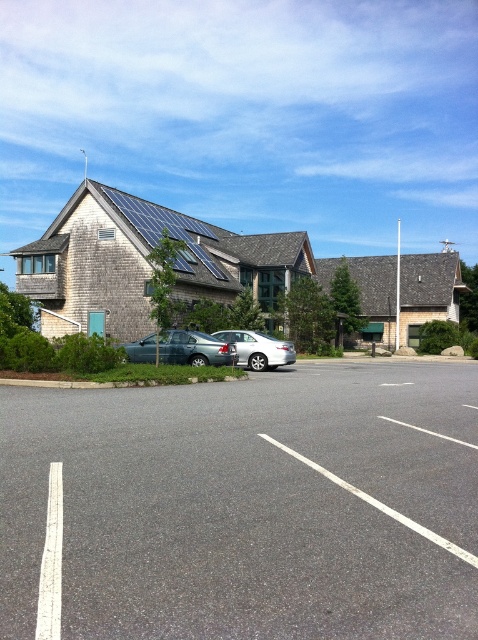
You are standing in front of the modern building with solar panels. You see a point marked at coordinates (51, 561). What does this point indicate?

The point at coordinates (51, 561) indicates the white painted line at lower left.

You are trying to park your car in the parking lot shown in the image. The parking space has a white painted line at lower left. Can you fit your car into the parking space if your car is as wide as the gray asphalt parking lot at center?

The gray asphalt parking lot at center is wider than the white painted line at lower left, so if your car is as wide as the parking lot, it will not fit within the parking space marked by the white painted line at lower left since the line is narrower.